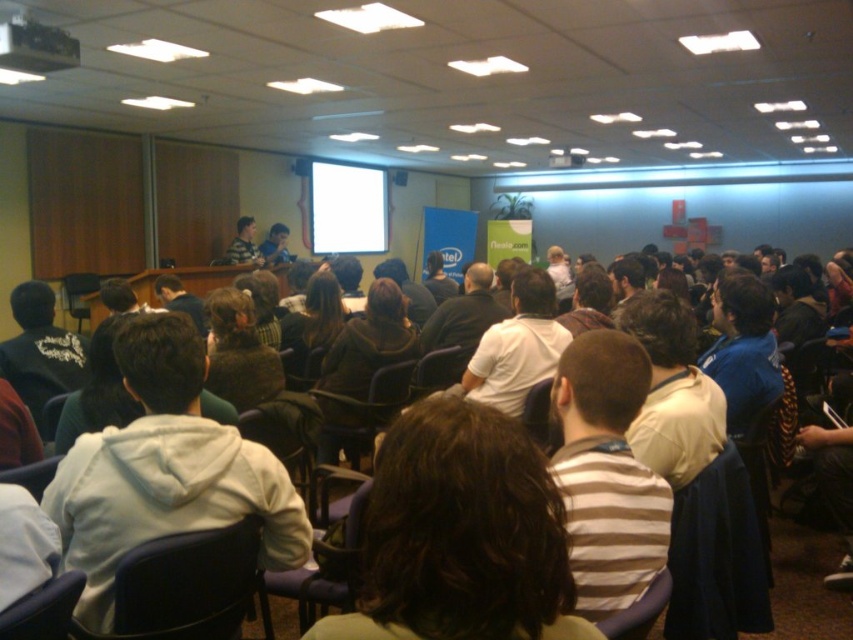
Question: Which point is farther to the camera?

Choices:
 (A) (350, 172)
 (B) (744, 502)
 (C) (22, 486)
 (D) (636, 296)

Answer: (A)

Question: Is white glossy projection screen at upper center behind matte plastic chair at center?

Choices:
 (A) no
 (B) yes

Answer: (B)

Question: Does white cotton shirt at center lie behind dark brown leather chair at center?

Choices:
 (A) no
 (B) yes

Answer: (B)

Question: Which point is closer to the camera?

Choices:
 (A) dark blue fabric chair at lower left
 (B) white fleece jacket at left
 (C) knitted wool sweater at center

Answer: (A)

Question: Can you confirm if blue fabric jacket at center is thinner than matte plastic chair at center?

Choices:
 (A) yes
 (B) no

Answer: (B)

Question: Which object is the farthest from the white glossy projection screen at upper center?

Choices:
 (A) white cotton shirt at center
 (B) striped cotton shirt at center
 (C) black plastic chair at lower left

Answer: (B)